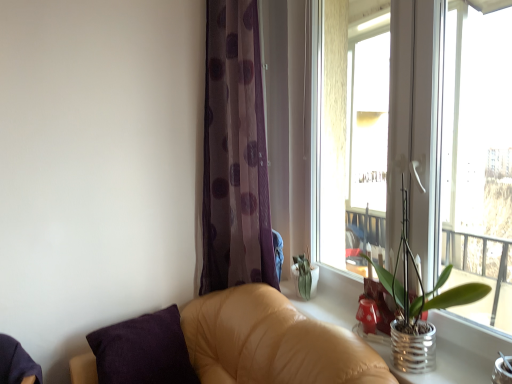
Question: Is silver metallic pot at right in front of or behind tan leather couch at lower right in the image?

Choices:
 (A) behind
 (B) front

Answer: (A)

Question: Considering the positions of silver metallic pot at right and tan leather couch at lower right in the image, is silver metallic pot at right bigger or smaller than tan leather couch at lower right?

Choices:
 (A) small
 (B) big

Answer: (A)

Question: Which object is the closest to the silver metallic pot at right?

Choices:
 (A) metallic silver pot at right
 (B) purple cotton pillow at lower left
 (C) translucent purple curtain at center
 (D) tan leather couch at lower right
 (E) transparent glass window at upper right

Answer: (A)

Question: Which object is the closest to the metallic silver pot at right?

Choices:
 (A) transparent glass window at upper right
 (B) silver metallic pot at right
 (C) translucent purple curtain at center
 (D) purple cotton pillow at lower left
 (E) tan leather couch at lower right

Answer: (B)